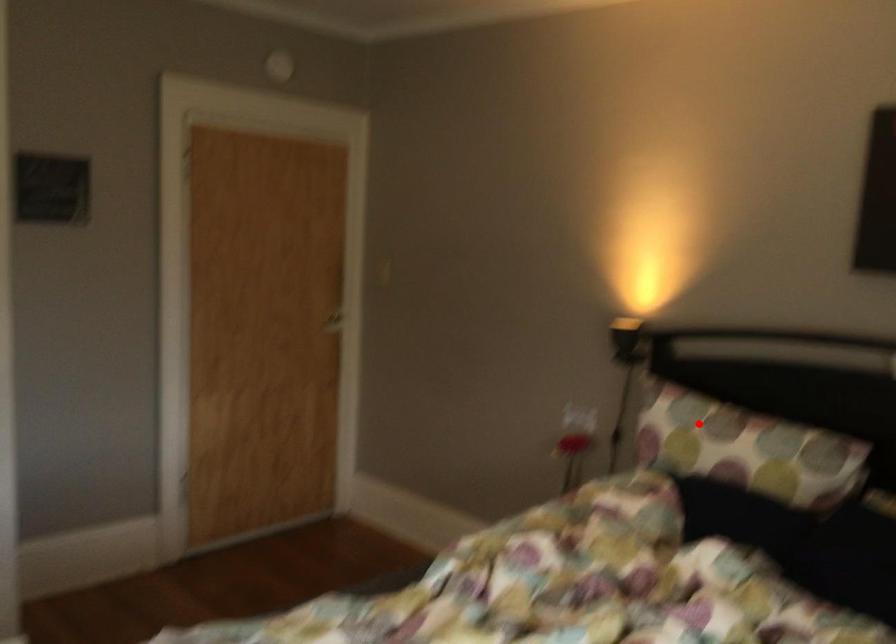
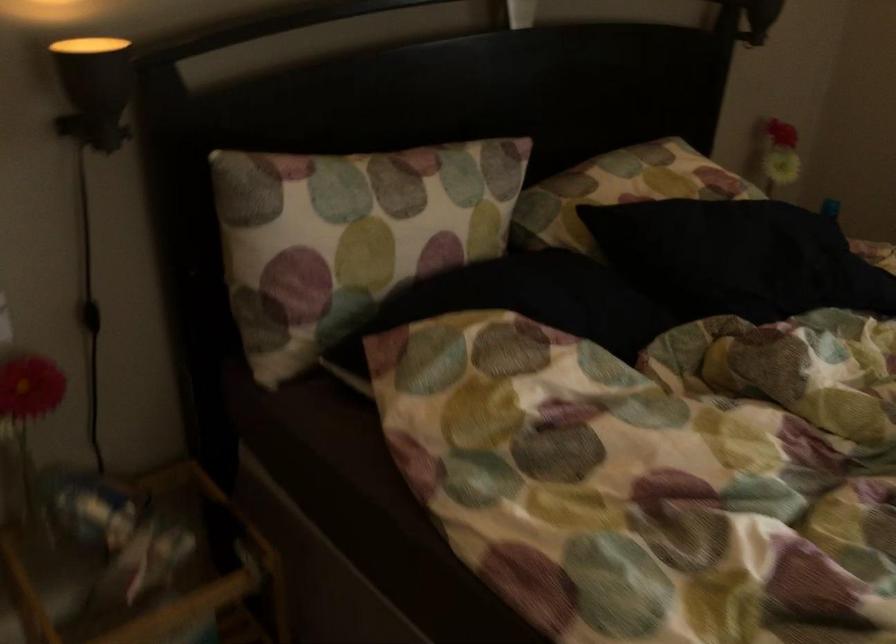
Question: I am providing you with two images of the same scene from different viewpoints. Image1 has a red point marked. In image2, the corresponding 3D location appears at what relative position? Reply with the corresponding letter.

Choices:
 (A) Closer
 (B) Farther

Answer: (A)